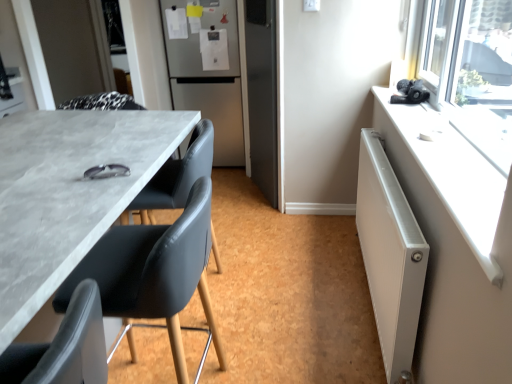
Question: Does black leather chair at lower left, the 1th chair when ordered from front to back, lie behind matte black chair at left, arranged as the 2th chair when viewed from the back?

Choices:
 (A) no
 (B) yes

Answer: (A)

Question: Is black leather chair at lower left, the 1th chair when ordered from front to back, oriented away from matte black chair at left, positioned as the second chair in front-to-back order?

Choices:
 (A) no
 (B) yes

Answer: (A)

Question: From a real-world perspective, is black leather chair at lower left, the 1th chair when ordered from front to back, below matte black chair at left, arranged as the 2th chair when viewed from the back?

Choices:
 (A) no
 (B) yes

Answer: (A)

Question: Can you confirm if black leather chair at lower left, the 1th chair when ordered from front to back, is taller than matte black chair at left, positioned as the second chair in front-to-back order?

Choices:
 (A) no
 (B) yes

Answer: (A)

Question: Considering the relative sizes of black leather chair at lower left, the 1th chair when ordered from front to back, and matte black chair at left, arranged as the 2th chair when viewed from the back, in the image provided, is black leather chair at lower left, the 1th chair when ordered from front to back, wider than matte black chair at left, arranged as the 2th chair when viewed from the back,?

Choices:
 (A) yes
 (B) no

Answer: (B)

Question: Does black leather chair at lower left, the 1th chair when ordered from front to back, have a lesser width compared to matte black chair at left, arranged as the 2th chair when viewed from the back?

Choices:
 (A) no
 (B) yes

Answer: (B)

Question: Does white metallic radiator at right appear on the left side of satin silver refrigerator at center?

Choices:
 (A) no
 (B) yes

Answer: (A)

Question: Is white metallic radiator at right facing away from satin silver refrigerator at center?

Choices:
 (A) no
 (B) yes

Answer: (A)

Question: Is white metallic radiator at right at the right side of satin silver refrigerator at center?

Choices:
 (A) yes
 (B) no

Answer: (A)

Question: Is white metallic radiator at right further to camera compared to satin silver refrigerator at center?

Choices:
 (A) yes
 (B) no

Answer: (B)

Question: Can you confirm if white metallic radiator at right is shorter than satin silver refrigerator at center?

Choices:
 (A) yes
 (B) no

Answer: (A)

Question: Does white metallic radiator at right have a lesser width compared to satin silver refrigerator at center?

Choices:
 (A) yes
 (B) no

Answer: (A)

Question: From the image's perspective, is black leather chair at lower left, the 1th chair when ordered from front to back, located above matte black chair at center, which appears as the 1th chair when viewed from the back?

Choices:
 (A) yes
 (B) no

Answer: (B)